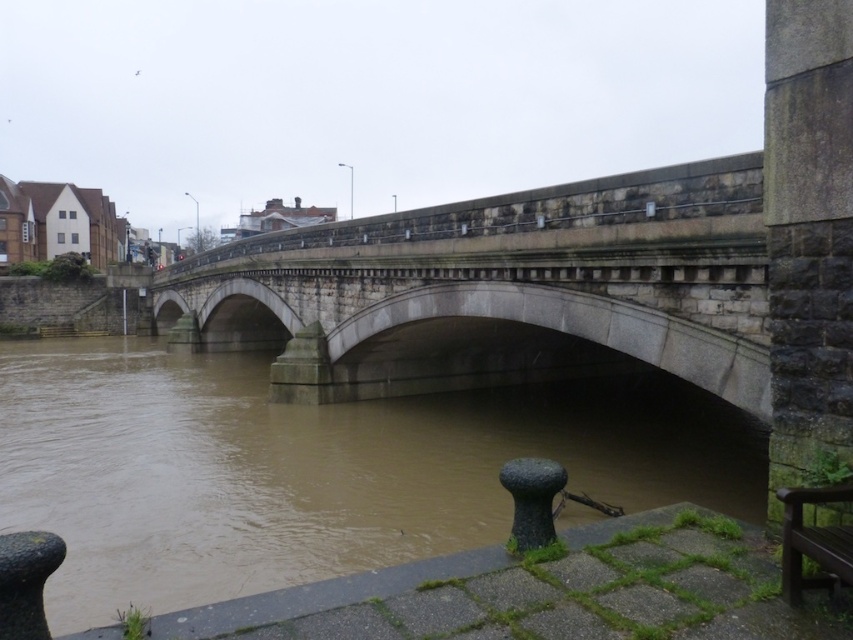
Question: Which object appears farthest from the camera in this image?

Choices:
 (A) brown muddy water at center
 (B) stone bridge at center

Answer: (B)

Question: Which of the following is the farthest from the observer?

Choices:
 (A) wooden park bench at lower right
 (B) stone bridge at center
 (C) brown muddy water at center

Answer: (B)

Question: Can you confirm if brown muddy water at center is thinner than stone bridge at center?

Choices:
 (A) yes
 (B) no

Answer: (A)

Question: Observing the image, what is the correct spatial positioning of brown muddy water at center in reference to wooden park bench at lower right?

Choices:
 (A) below
 (B) above

Answer: (A)

Question: Which point is farther from the camera taking this photo?

Choices:
 (A) (741, 248)
 (B) (795, 596)
 (C) (693, 412)

Answer: (C)

Question: Is brown muddy water at center thinner than stone bridge at center?

Choices:
 (A) no
 (B) yes

Answer: (B)